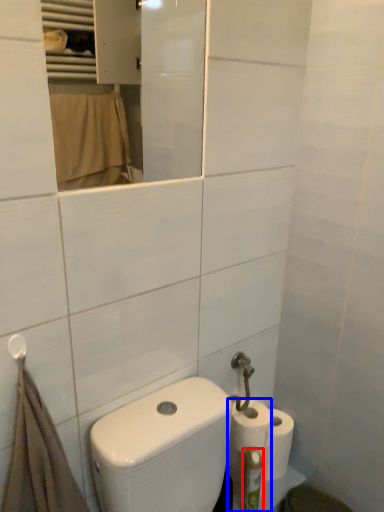
Question: Which point is closer to the camera, toiletry (highlighted by a red box) or toilet paper (highlighted by a blue box)?

Choices:
 (A) toiletry
 (B) toilet paper

Answer: (A)